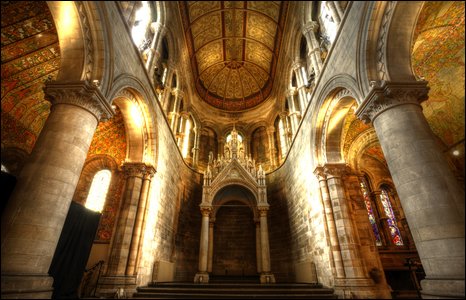
Identify the location of red spots on top ceiling. (109, 145), (13, 89), (7, 56), (377, 151), (360, 128).